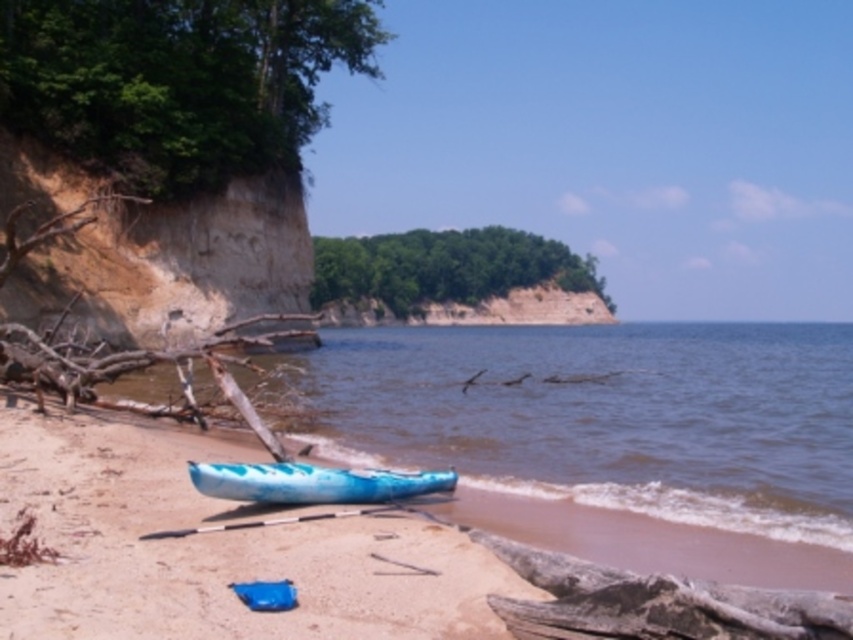
Is point (254, 544) less distant than point (306, 472)?

Yes, it is in front of point (306, 472).

Can you confirm if blue plastic kayak at center is taller than blue glossy canoe at lower center?

Yes, blue plastic kayak at center is taller than blue glossy canoe at lower center.

The image size is (853, 640). Identify the location of blue plastic kayak at center. (213, 547).